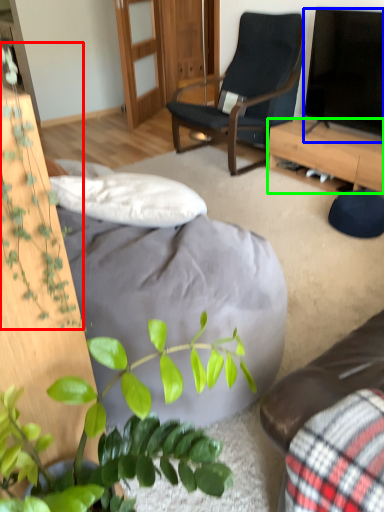
Question: Which object is the closest to the vegetation (highlighted by a red box)? Choose among these: television (highlighted by a blue box) or desk (highlighted by a green box).

Choices:
 (A) television
 (B) desk

Answer: (B)